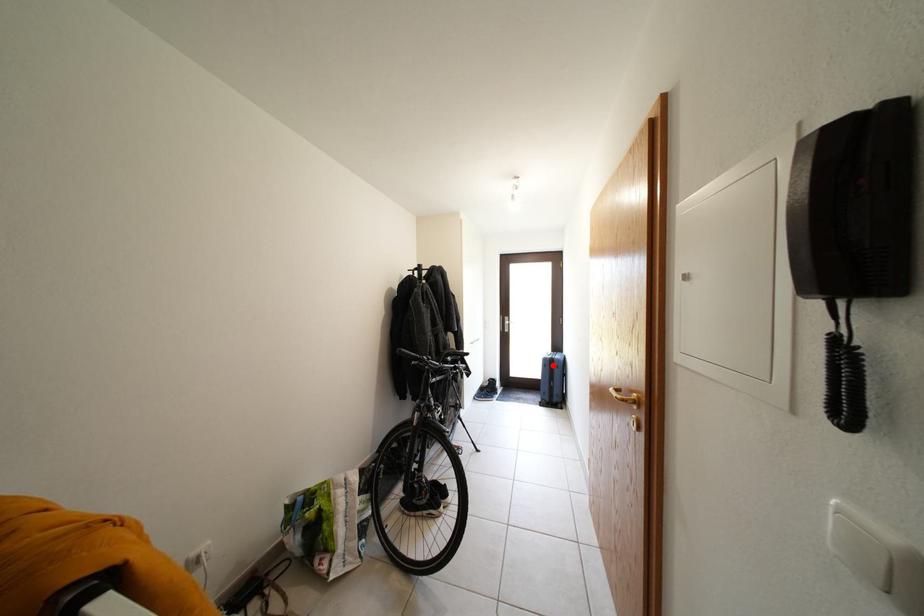
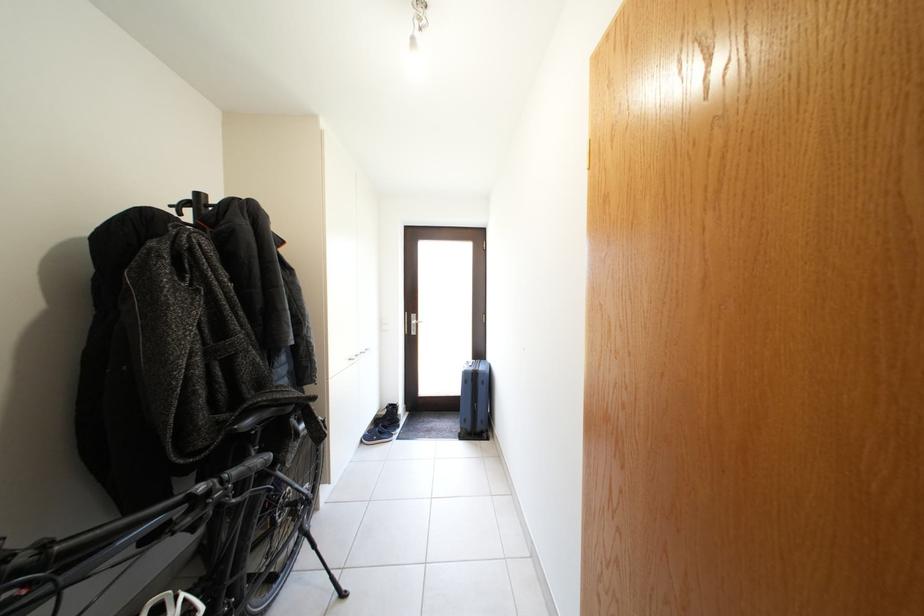
Where in the second image is the point corresponding to the highlighted location from the first image?

(473, 379)